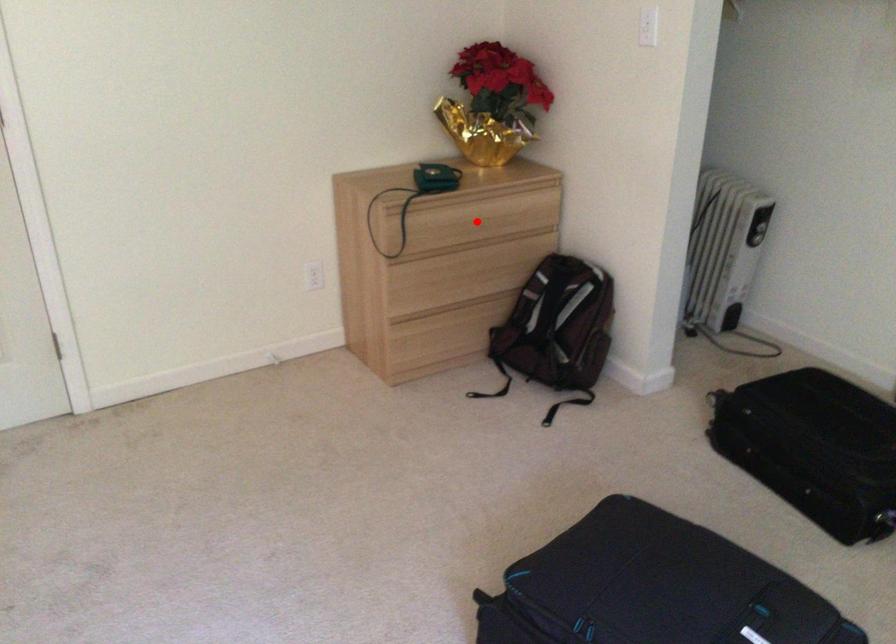
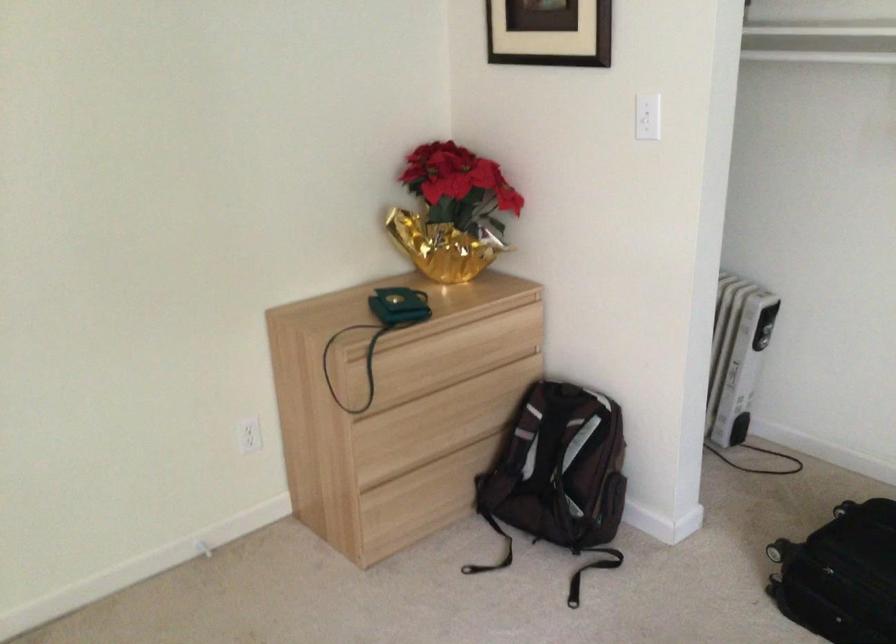
The point at the highlighted location is marked in the first image. Where is the corresponding point in the second image?

(454, 355)